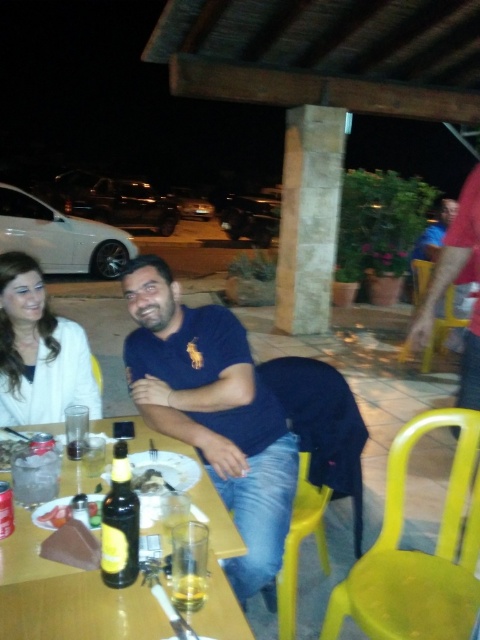
Question: Which point appears farthest from the camera in this image?

Choices:
 (A) (56, 500)
 (B) (23, 348)

Answer: (B)

Question: Does wooden table at center have a greater width compared to translucent glass plate at table center?

Choices:
 (A) no
 (B) yes

Answer: (B)

Question: Is translucent plastic container at table center wider than translucent glass at table center?

Choices:
 (A) yes
 (B) no

Answer: (A)

Question: Does matte blue polo shirt at center have a lesser width compared to amber glass bottle at table center?

Choices:
 (A) no
 (B) yes

Answer: (A)

Question: Considering the real-world distances, which object is farthest from the white knit sweater at upper left?

Choices:
 (A) matte blue polo shirt at center
 (B) wooden table at center
 (C) smooth white cheese at center

Answer: (C)

Question: Which object is farther from the camera taking this photo?

Choices:
 (A) matte blue polo shirt at center
 (B) smooth white cheese at center

Answer: (B)